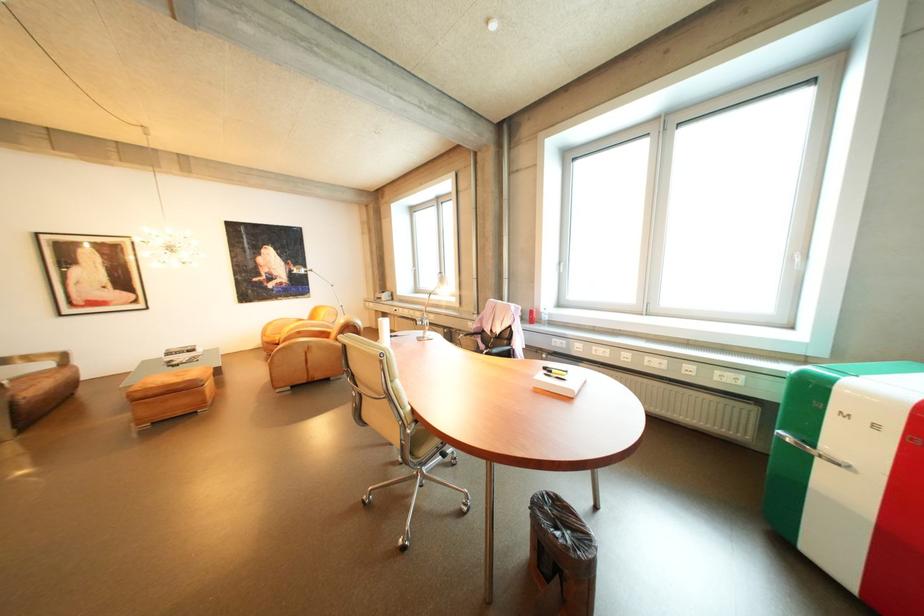
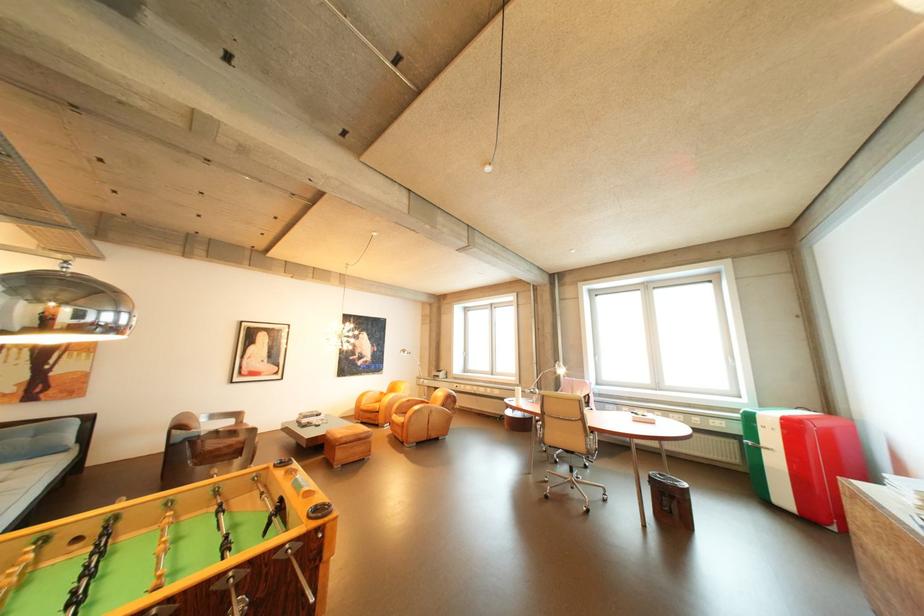
In the second image, find the point that corresponds to [282,334] in the first image.

(377, 403)